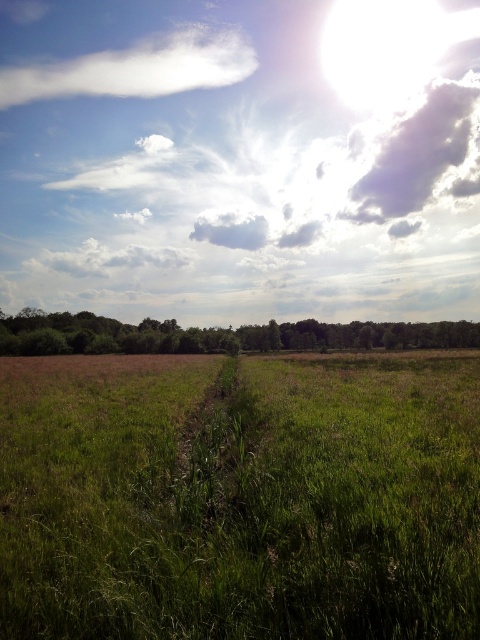
You are an artist painting the rural landscape described. You want to ensure the bright white cloud at upper center and the green grassy at center are proportionally accurate. Which object should you make wider in your painting?

The bright white cloud at upper center should be made wider than the green grassy at center because its width surpasses the grassy area according to the description.

What are the coordinates of the white fluffy cloud at upper left in the image?

The white fluffy cloud at upper left is located at coordinates point (136, 68).